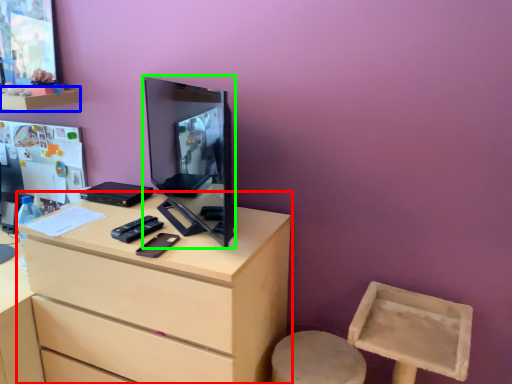
Question: Which is nearer to the chest of drawers (highlighted by a red box)? shelf (highlighted by a blue box) or computer monitor (highlighted by a green box).

Choices:
 (A) shelf
 (B) computer monitor

Answer: (B)